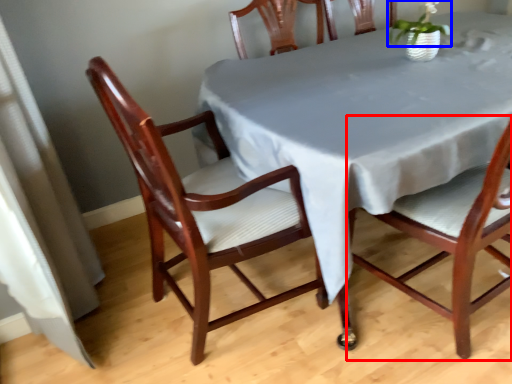
Question: Which object is further to the camera taking this photo, chair (highlighted by a red box) or plant (highlighted by a blue box)?

Choices:
 (A) chair
 (B) plant

Answer: (B)